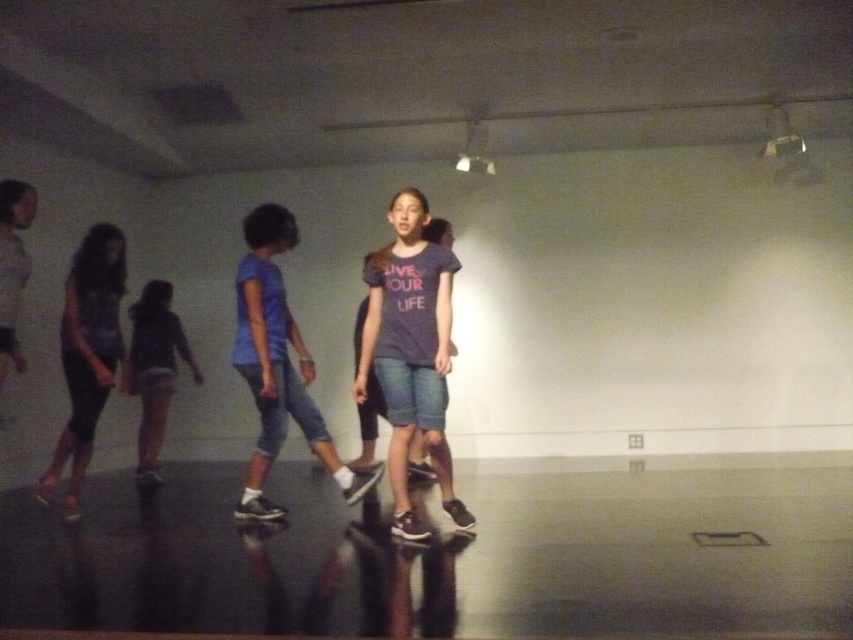
You are a photographer adjusting your camera settings. You need to focus on two specific points in the image, point 1 at coordinates (91,424) and point 2 at coordinates (192,356). Which point should you focus on first to ensure proper depth of field for both points?

You should focus on point 1 at coordinates (91,424) first because it is closer to the camera than point 2 at coordinates (192,356), ensuring proper depth of field for both points.